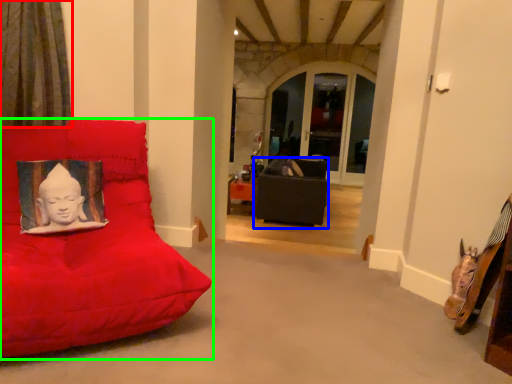
Question: Considering the real-world distances, which object is farthest from curtain (highlighted by a red box)? furniture (highlighted by a blue box) or furniture (highlighted by a green box)?

Choices:
 (A) furniture
 (B) furniture

Answer: (A)